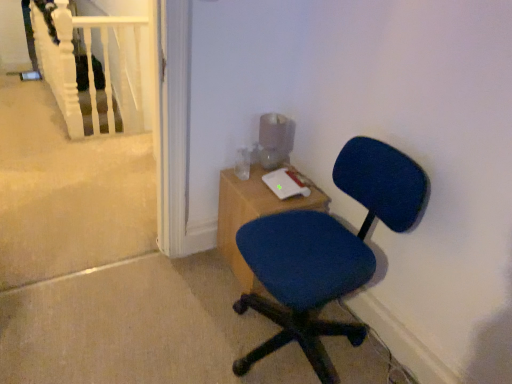
Question: Does wooden desk at center lie in front of white matte rail at upper left?

Choices:
 (A) no
 (B) yes

Answer: (B)

Question: Does wooden desk at center have a larger size compared to white matte rail at upper left?

Choices:
 (A) yes
 (B) no

Answer: (A)

Question: Is wooden desk at center surrounding white matte rail at upper left?

Choices:
 (A) yes
 (B) no

Answer: (B)

Question: Can you confirm if wooden desk at center is positioned to the right of white matte rail at upper left?

Choices:
 (A) no
 (B) yes

Answer: (B)

Question: Does wooden desk at center have a greater width compared to white matte rail at upper left?

Choices:
 (A) yes
 (B) no

Answer: (A)

Question: Is white matte rail at upper left at the back of wooden desk at center?

Choices:
 (A) no
 (B) yes

Answer: (B)

Question: Is blue fabric chair at center completely or partially inside white matte rail at upper left?

Choices:
 (A) no
 (B) yes

Answer: (A)

Question: From a real-world perspective, is white matte rail at upper left located higher than blue fabric chair at center?

Choices:
 (A) yes
 (B) no

Answer: (A)

Question: From the image's perspective, is white matte rail at upper left located beneath blue fabric chair at center?

Choices:
 (A) no
 (B) yes

Answer: (A)

Question: Does white matte rail at upper left have a lesser height compared to blue fabric chair at center?

Choices:
 (A) yes
 (B) no

Answer: (B)

Question: Is white matte rail at upper left in front of blue fabric chair at center?

Choices:
 (A) no
 (B) yes

Answer: (A)

Question: Does white matte rail at upper left appear on the right side of blue fabric chair at center?

Choices:
 (A) no
 (B) yes

Answer: (A)

Question: From the image's perspective, is wooden desk at center located above blue fabric chair at center?

Choices:
 (A) yes
 (B) no

Answer: (A)